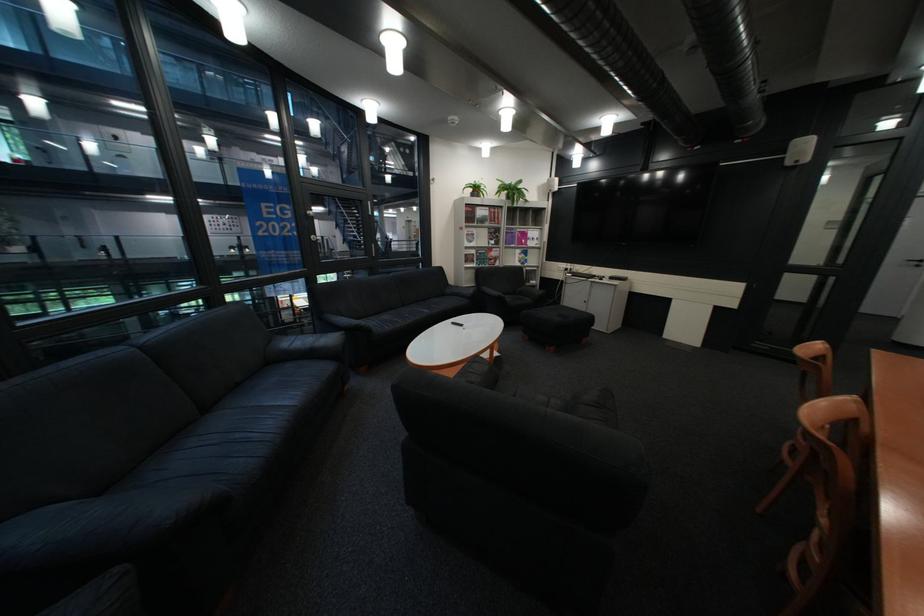
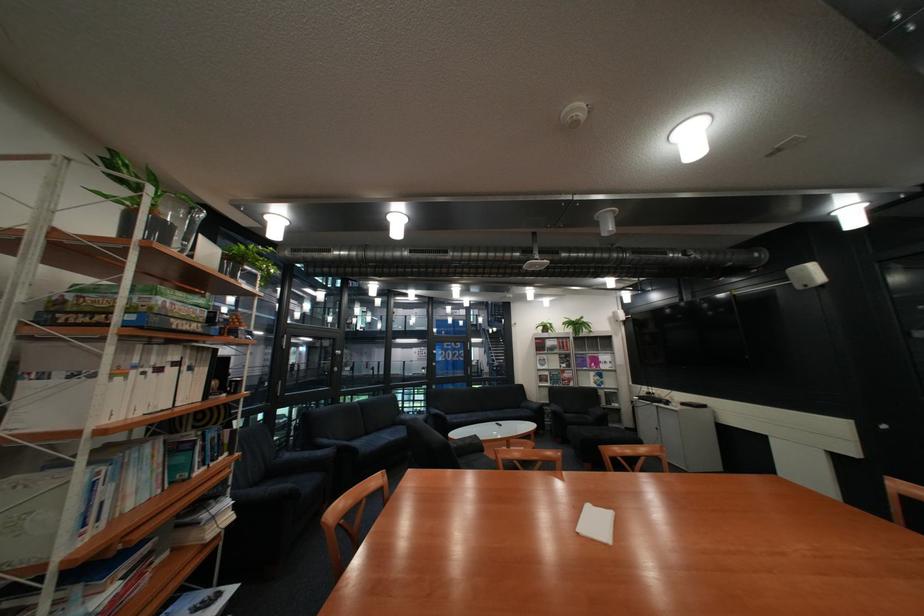
Find the pixel in the second image that matches [458,294] in the first image.

(535, 408)